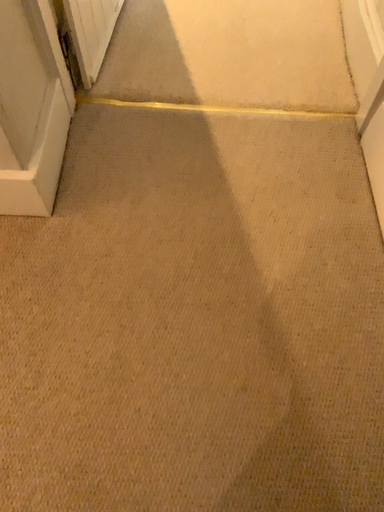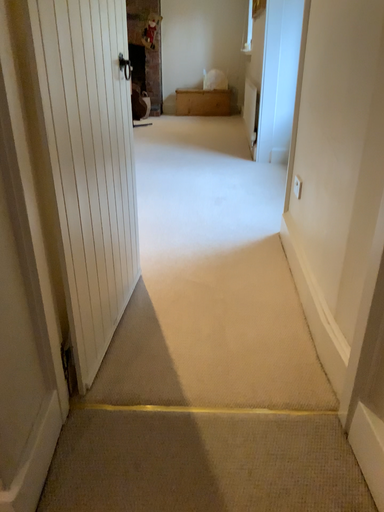
Question: Which way did the camera rotate in the video?

Choices:
 (A) rotated upward
 (B) rotated downward

Answer: (A)